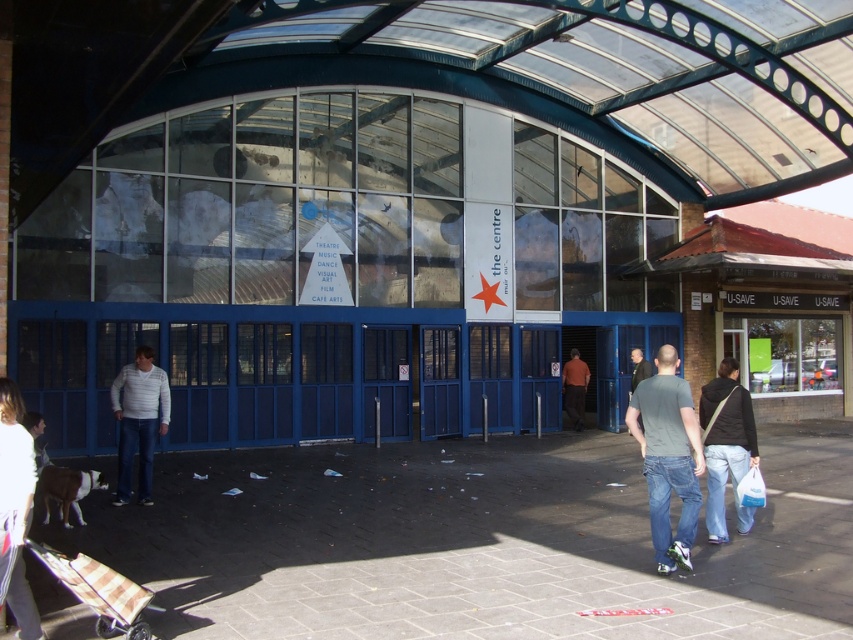
Looking at this image, you are a fashion designer observing two white sweaters in an urban setting. The scene includes a modern building with a curved roof and a sign mentioning arts activities. You notice the white cotton sweater at lower left and the white sweater at center. Which sweater has a thicker material?

The white sweater at center has a thicker material than the white cotton sweater at lower left.